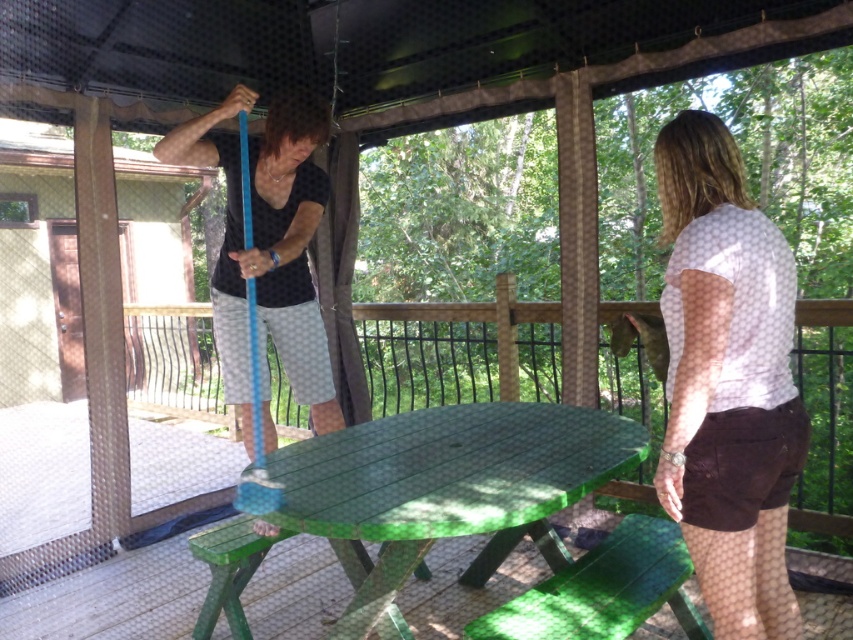
Can you confirm if green wood picnic table at center is bigger than green painted wood table at center?

No.

Measure the distance between point (648,460) and camera.

Point (648,460) and camera are 4.47 meters apart.

Measure the distance between green wood picnic table at center and camera.

6.49 meters

What are the coordinates of `green wood picnic table at center` in the screenshot? It's located at (115, 598).

Does white dotted shirt at center appear over green painted wood table at center?

Correct, white dotted shirt at center is located above green painted wood table at center.

Where is `white dotted shirt at center`? The height and width of the screenshot is (640, 853). white dotted shirt at center is located at coordinates [727, 381].

Between point (689, 328) and point (372, 488), which one is positioned in front?

Point (689, 328) is in front.

Find the location of `white dotted shirt at center`. white dotted shirt at center is located at coordinates (727, 381).

Who is positioned more to the left, green wood picnic table at center or white dotted shirt at center?

Positioned to the left is green wood picnic table at center.

Is point (190, 616) positioned behind point (675, 172)?

Yes, point (190, 616) is farther from viewer.

You are a GUI agent. You are given a task and a screenshot of the screen. Output one action in this format:
    pyautogui.click(x=<x>, y=<y>)
    Task: Click on the green wood picnic table at center
    The height and width of the screenshot is (640, 853).
    Given the screenshot: What is the action you would take?
    pos(115,598)